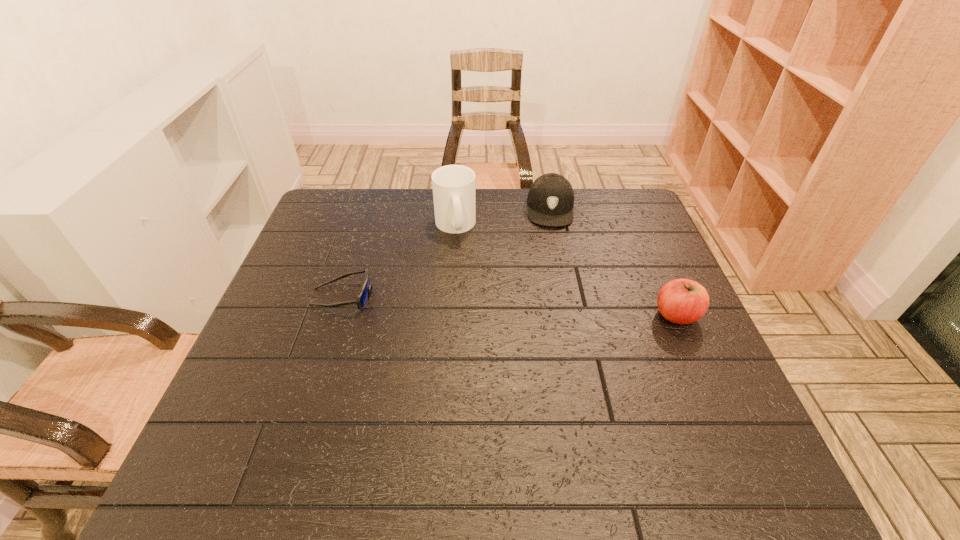
Identify the location of vacant space located on the handle side of the mug. (493, 309).

The image size is (960, 540). In order to click on vacant space situated 0.320m on the front-facing side of the cap in this screenshot , I will do `click(552, 306)`.

The width and height of the screenshot is (960, 540). Identify the location of vacant space situated on the front-facing side of the cap. (552, 241).

Where is `free space located on the front-facing side of the cap`? The width and height of the screenshot is (960, 540). free space located on the front-facing side of the cap is located at coordinates (552, 255).

At what (x,y) coordinates should I click in order to perform the action: click on mug present at the far edge. Please return your answer as a coordinate pair (x, y). Image resolution: width=960 pixels, height=540 pixels. Looking at the image, I should click on (453, 186).

At what (x,y) coordinates should I click in order to perform the action: click on cap that is at the far edge. Please return your answer as a coordinate pair (x, y). Looking at the image, I should click on (550, 198).

I want to click on object that is at the left edge, so click(x=363, y=297).

At what (x,y) coordinates should I click in order to perform the action: click on object positioned at the right edge. Please return your answer as a coordinate pair (x, y). The width and height of the screenshot is (960, 540). Looking at the image, I should click on (682, 301).

This screenshot has height=540, width=960. I want to click on free space at the far edge of the desktop, so (x=392, y=198).

Where is `vacant space at the near edge of the desktop`? vacant space at the near edge of the desktop is located at coordinates (319, 411).